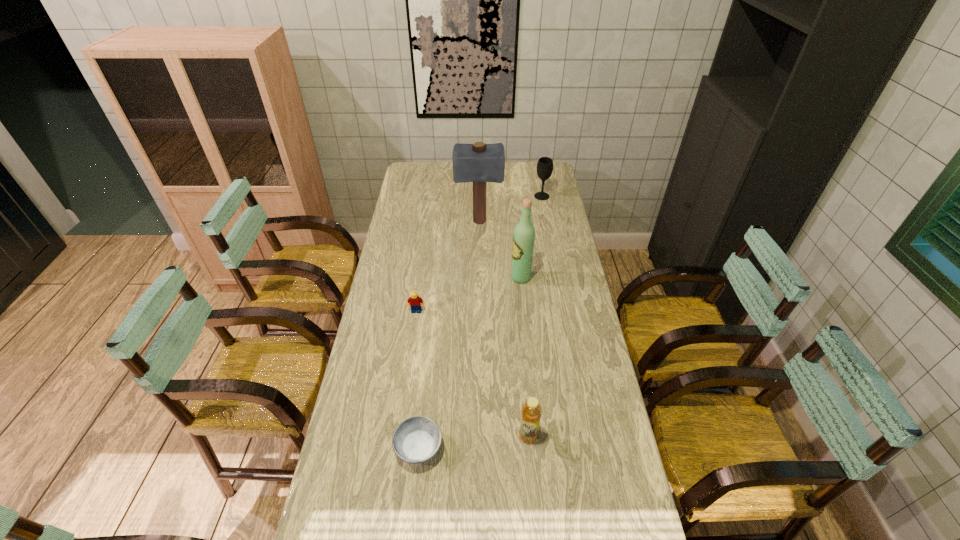
I want to click on vacant space that's between the shortest object and the wine bottle, so (469, 363).

What are the coordinates of `object that stands as the fifth closest to the wineglass` in the screenshot? It's located at click(x=415, y=440).

Locate which object ranks fourth in proximity to the mallet. Please provide its 2D coordinates. Your answer should be formatted as a tuple, i.e. [(x, y)], where the tuple contains the x and y coordinates of a point satisfying the conditions above.

[(415, 440)]

Locate an element on the screen. free space that satisfies the following two spatial constraints: 1. on the front-facing side of the third farthest object; 2. on the front-facing side of the Lego is located at coordinates (524, 311).

Image resolution: width=960 pixels, height=540 pixels. Identify the location of free space that satisfies the following two spatial constraints: 1. on the back side of the farthest object; 2. on the right side of the mallet. (479, 196).

Identify the location of vacant position in the image that satisfies the following two spatial constraints: 1. on the front side of the bottle; 2. on the left side of the second farthest object. (478, 436).

Where is `free point that satisfies the following two spatial constraints: 1. on the front-facing side of the third farthest object; 2. on the front side of the ashtray`? The width and height of the screenshot is (960, 540). free point that satisfies the following two spatial constraints: 1. on the front-facing side of the third farthest object; 2. on the front side of the ashtray is located at coordinates 538,449.

I want to click on vacant area in the image that satisfies the following two spatial constraints: 1. on the front-facing side of the fourth nearest object; 2. on the front side of the ashtray, so click(x=538, y=449).